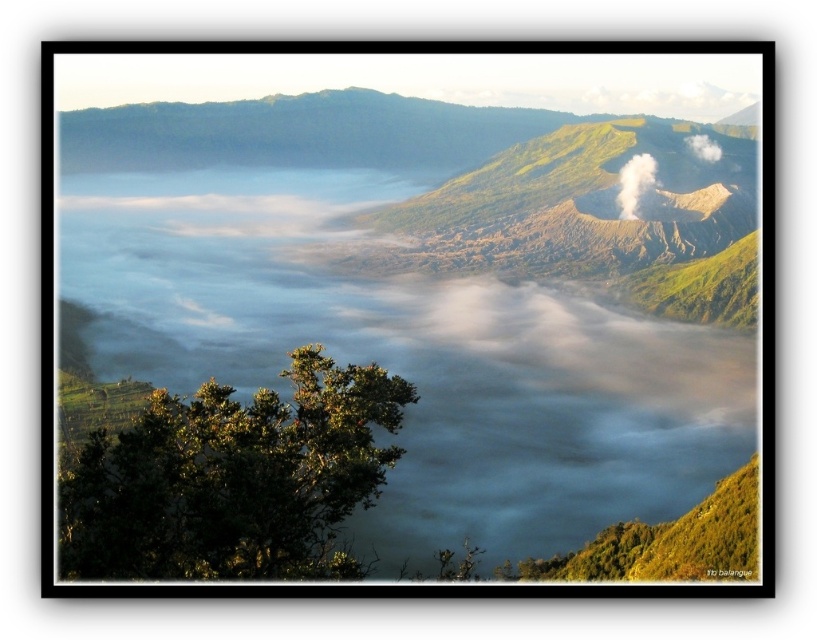
Question: Can you confirm if green leafy tree at lower left is bigger than white smoke at upper center?

Choices:
 (A) yes
 (B) no

Answer: (A)

Question: Which of the following is the closest to the observer?

Choices:
 (A) white smoke at upper center
 (B) green leafy tree at lower left

Answer: (B)

Question: Which is nearer to the white misty cloud at center?

Choices:
 (A) white smoke at upper center
 (B) green leafy tree at lower left

Answer: (A)

Question: Observing the image, what is the correct spatial positioning of green leafy tree at lower left in reference to white smoke at upper center?

Choices:
 (A) right
 (B) left

Answer: (B)

Question: Where is green leafy tree at lower left located in relation to white smoke at upper center in the image?

Choices:
 (A) above
 (B) below

Answer: (B)

Question: Which of the following is the closest to the observer?

Choices:
 (A) white smoke at upper center
 (B) white misty cloud at center
 (C) green leafy tree at lower left

Answer: (C)